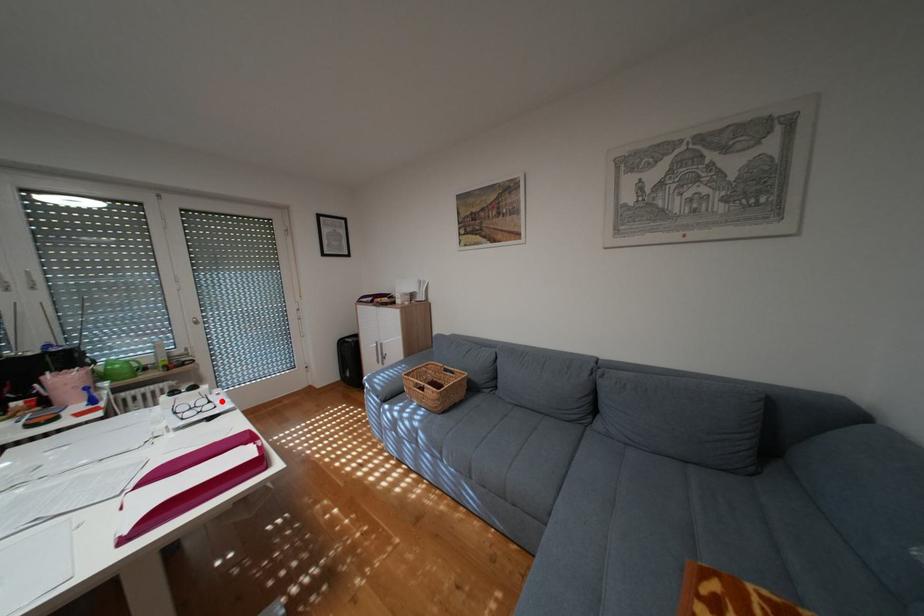
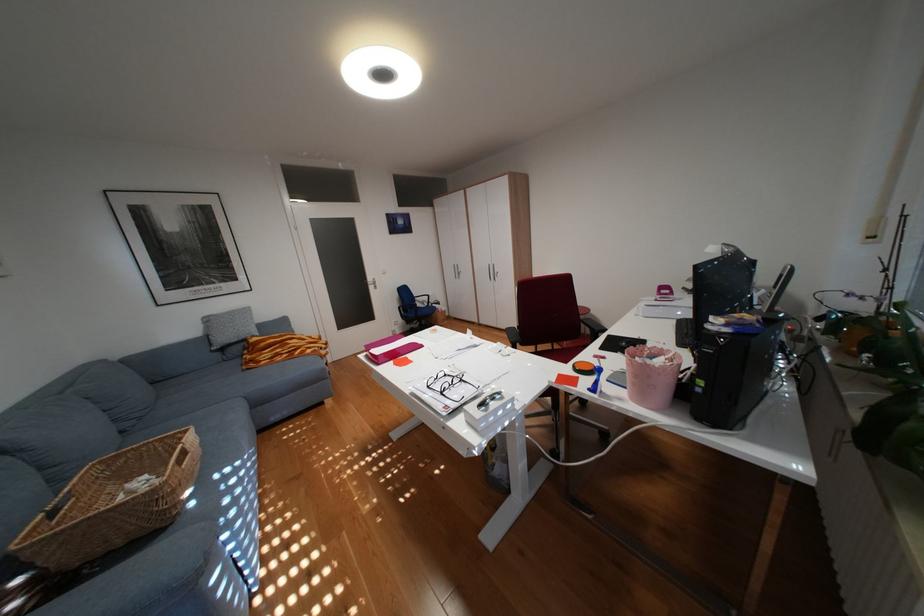
Find the pixel in the second image that matches the highlighted location in the first image.

(454, 392)